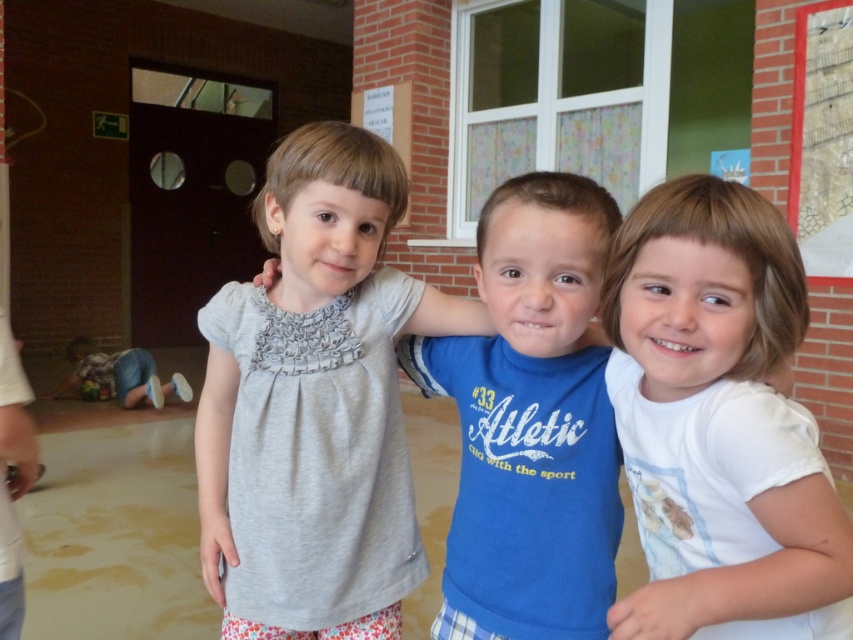
You are a photographer setting up a photo shoot for a clothing brand. You need to arrange the blue cotton shirt at center and the blue denim jeans at lower left in a way that they appear proportional in the final image. Considering their actual sizes, which item should you place closer to the camera to achieve this?

The blue denim jeans at lower left should be placed closer to the camera because the blue cotton shirt at center is much taller than the blue denim jeans at lower left. To make them appear proportional in size, the shorter jeans need to be positioned nearer to the camera.

You are a photographer setting up for a group photo. You need to ensure that the matte gray shirt at center and the white cotton shirt at right are both visible in the frame. Considering their heights, which shirt will appear taller in the photo?

The matte gray shirt at center will appear taller in the photo because it has a greater height compared to the white cotton shirt at right.

You are a photographer setting up for a group photo. You need to position the children so that the white cotton shirt at right is to the right of the blue cotton shirt at center. Based on their current positions, is this already the case?

Yes, the white cotton shirt at right is already positioned to the right of the blue cotton shirt at center as described.